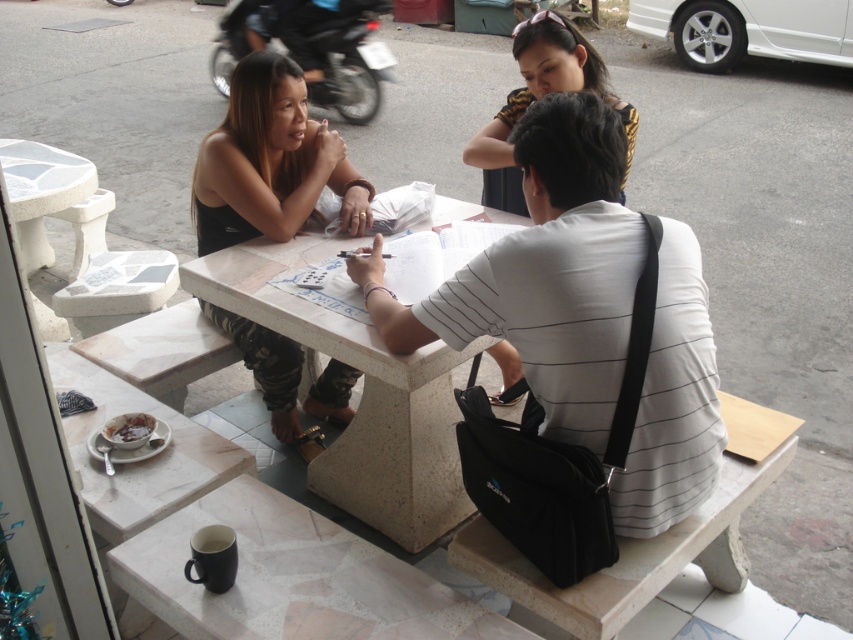
Question: Which point is farther from the camera taking this photo?

Choices:
 (A) (486, 196)
 (B) (746, 474)
 (C) (334, 333)

Answer: (A)

Question: Is the position of yellow/black striped shirt at upper center less distant than that of white marble table at left?

Choices:
 (A) no
 (B) yes

Answer: (B)

Question: Which object is closer to the camera taking this photo?

Choices:
 (A) metallic blue motorcycle at upper left
 (B) white marble table at center
 (C) white marble table at left
 (D) yellow/black striped shirt at upper center

Answer: (D)

Question: Among these points, which one is farthest from the camera?

Choices:
 (A) (222, 88)
 (B) (50, 168)

Answer: (A)

Question: Where is black fabric bag at lower right located in relation to white marble table at left in the image?

Choices:
 (A) right
 (B) left

Answer: (A)

Question: Can you confirm if white marble table at center is positioned to the right of metallic blue motorcycle at upper left?

Choices:
 (A) yes
 (B) no

Answer: (A)